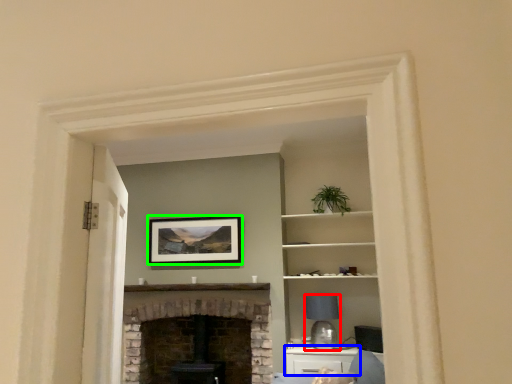
Question: Which is nearer to the lamp (highlighted by a red box)? cabinetry (highlighted by a blue box) or picture frame (highlighted by a green box).

Choices:
 (A) cabinetry
 (B) picture frame

Answer: (A)